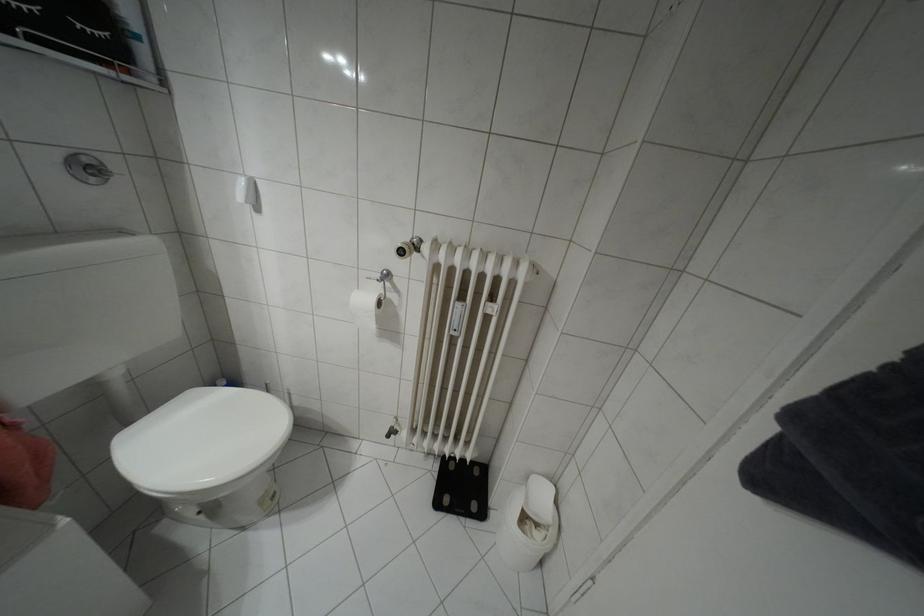
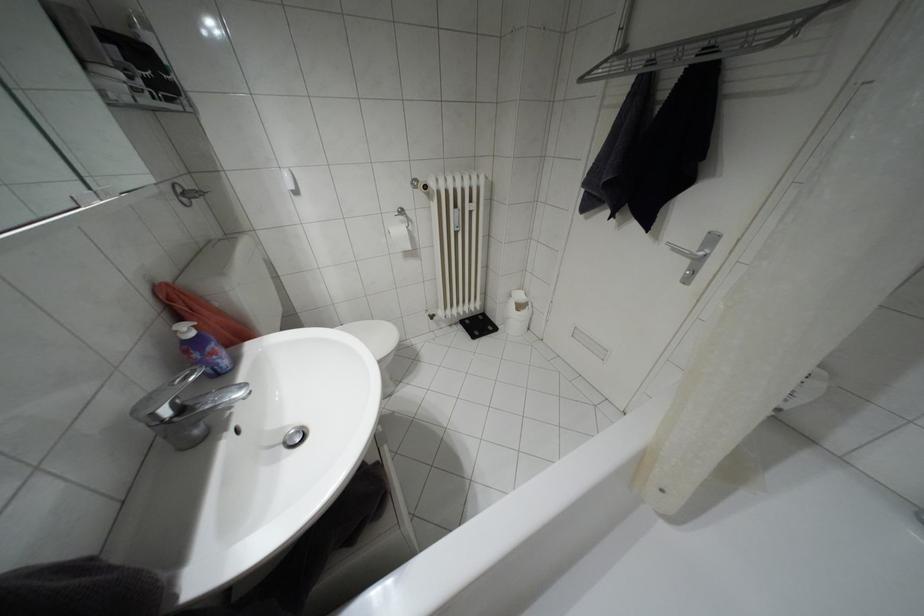
Where in the second image is the point corresponding to (436,504) from the first image?

(472, 336)